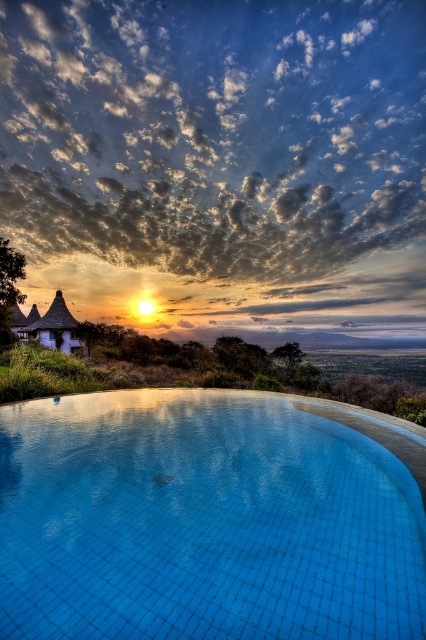
Which is above, blue tile swimming pool at lower center or wooden thatched hut at left?

wooden thatched hut at left is above.

Is the position of blue tile swimming pool at lower center more distant than that of wooden thatched hut at left?

No, it is not.

Is point (402, 508) farther from viewer compared to point (20, 326)?

No, it is not.

Locate an element on the screen. The image size is (426, 640). blue tile swimming pool at lower center is located at coordinates (203, 522).